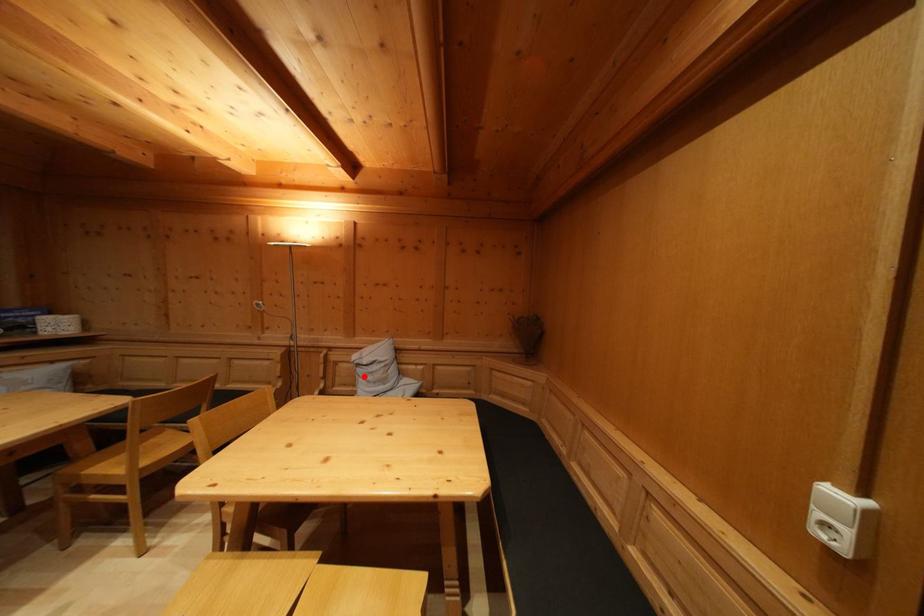
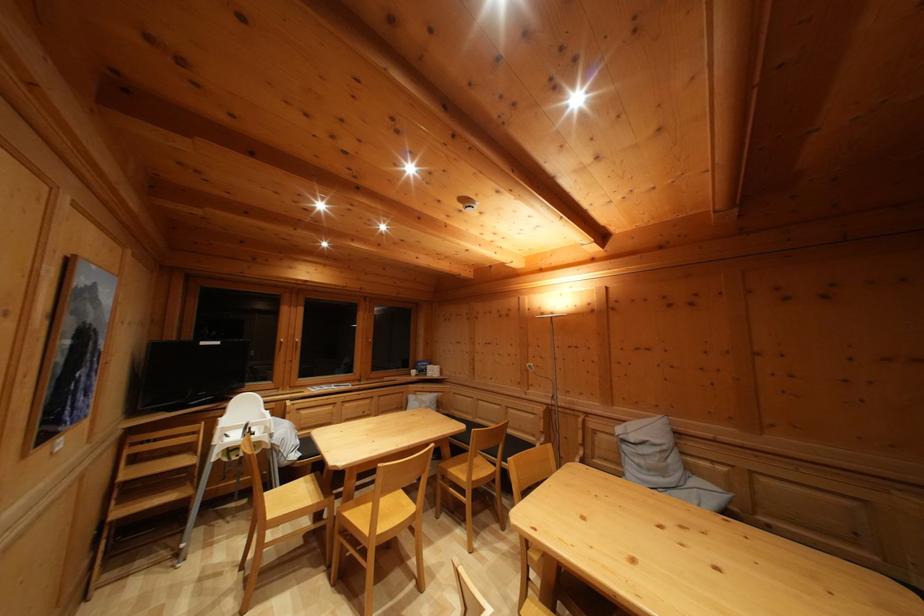
Locate, in the second image, the point that corresponds to the highlighted location in the first image.

(629, 454)